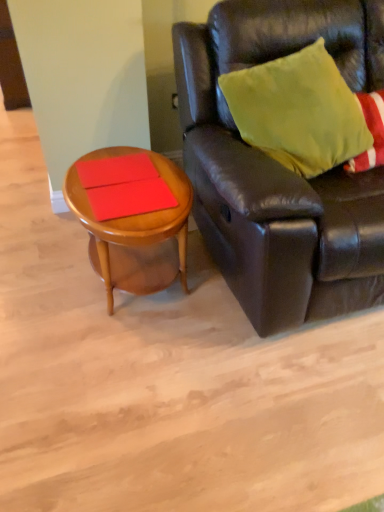
In order to click on empty space that is ontop of matte red book at left, the first plank viewed from the top (from a real-world perspective) in this screenshot , I will do `click(114, 165)`.